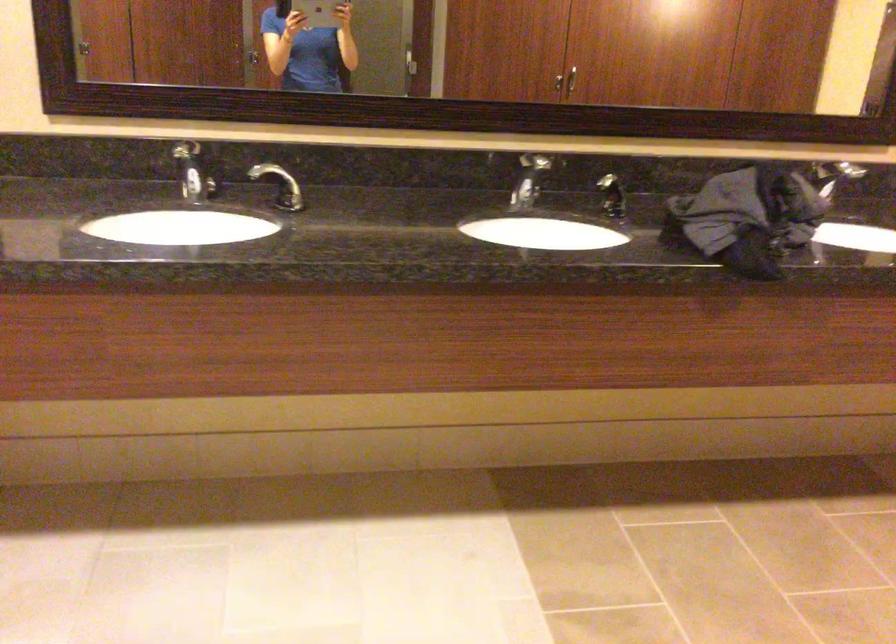
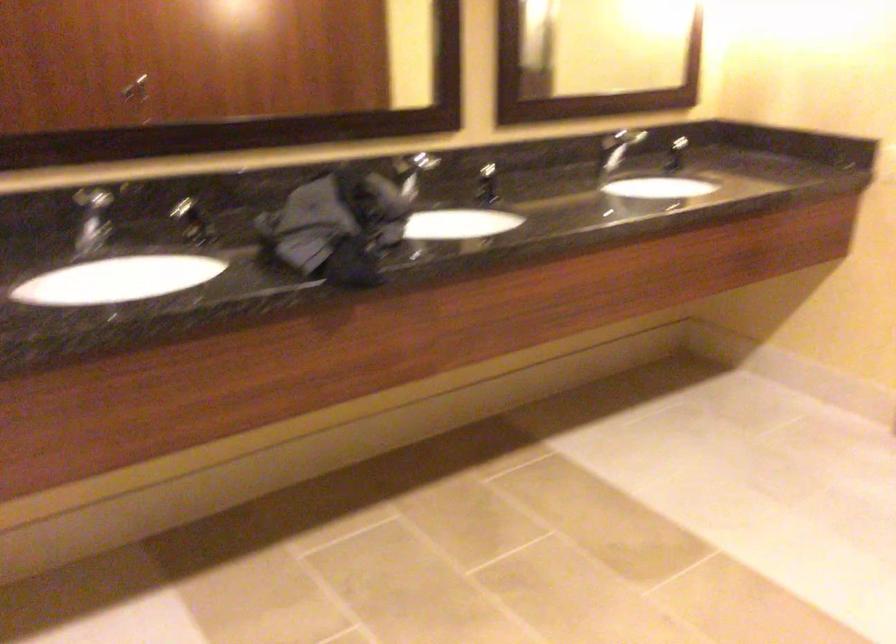
In the second image, find the point that corresponds to point 745,214 in the first image.

(337, 227)